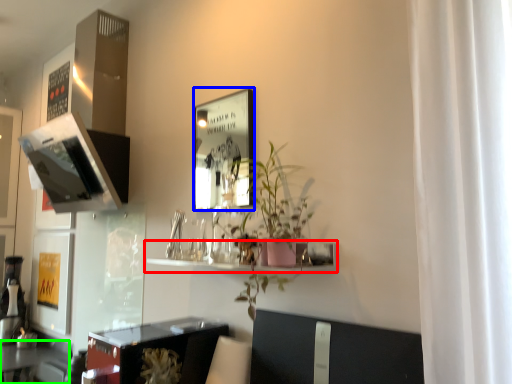
Question: Considering the real-world distances, which object is farthest from shelf (highlighted by a red box)? picture frame (highlighted by a blue box) or table (highlighted by a green box)?

Choices:
 (A) picture frame
 (B) table

Answer: (A)